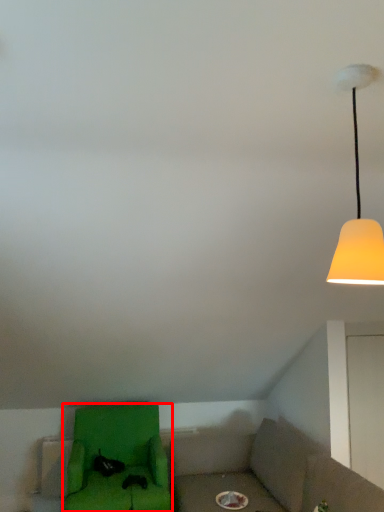
Question: From the image's perspective, what is the correct spatial relationship of furniture (annotated by the red box) in relation to lamp?

Choices:
 (A) below
 (B) above

Answer: (A)